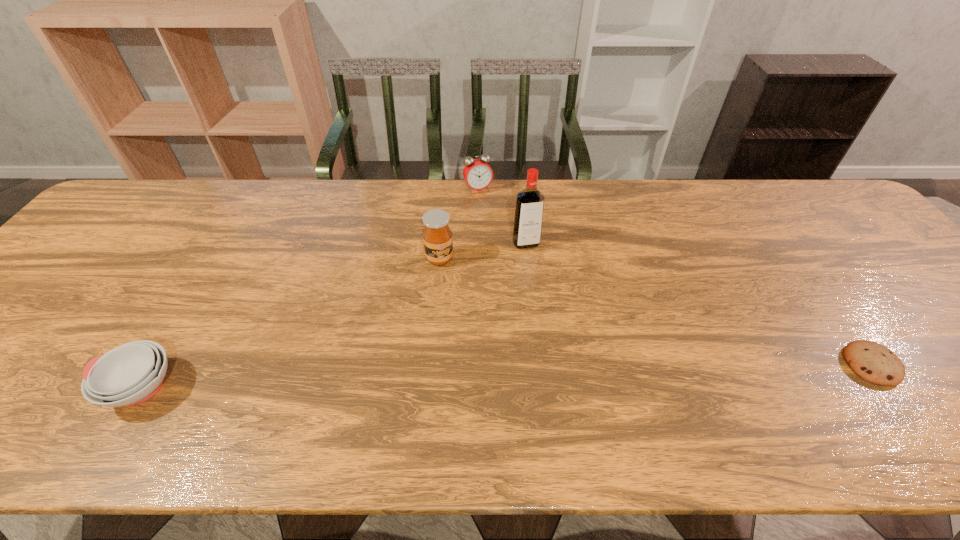
Identify the location of the fourth tallest object. The image size is (960, 540). (132, 373).

The width and height of the screenshot is (960, 540). In order to click on soup bowl in this screenshot , I will do (132, 373).

The image size is (960, 540). I want to click on the shortest object, so click(x=871, y=361).

This screenshot has height=540, width=960. In order to click on cookie in this screenshot , I will do `click(871, 361)`.

This screenshot has height=540, width=960. Identify the location of the second object from right to left. (528, 218).

The height and width of the screenshot is (540, 960). What are the coordinates of `the tallest object` in the screenshot? It's located at click(x=528, y=218).

Find the location of a particular element. Image resolution: width=960 pixels, height=540 pixels. the farthest object is located at coordinates (478, 175).

The width and height of the screenshot is (960, 540). Identify the location of alarm clock. (478, 175).

Locate an element on the screen. The image size is (960, 540). the fourth object from right to left is located at coordinates pyautogui.click(x=437, y=236).

You are a GUI agent. You are given a task and a screenshot of the screen. Output one action in this format:
    pyautogui.click(x=<x>, y=<y>)
    Task: Click on the honey
    This screenshot has width=960, height=540.
    Given the screenshot: What is the action you would take?
    pyautogui.click(x=437, y=236)